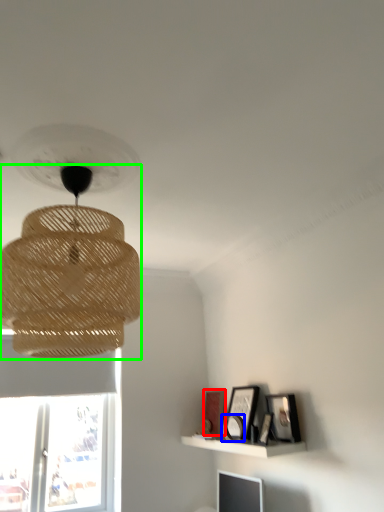
Question: Based on their relative distances, which object is farther from picture frame (highlighted by a red box)? Choose from picture frame (highlighted by a blue box) and lamp (highlighted by a green box).

Choices:
 (A) picture frame
 (B) lamp

Answer: (B)